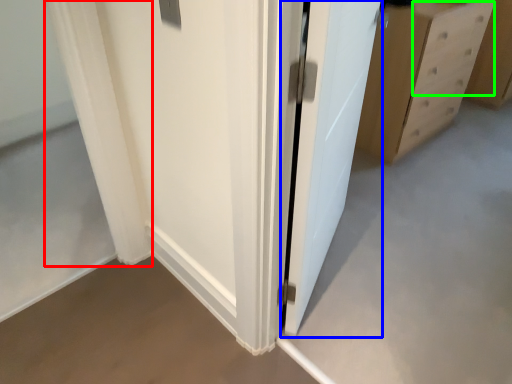
Question: Which is nearer to the curtain (highlighted by a red box)? door (highlighted by a blue box) or drawer (highlighted by a green box).

Choices:
 (A) door
 (B) drawer

Answer: (A)